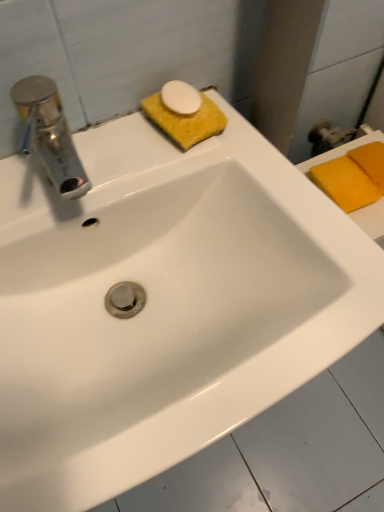
Question: From the image's perspective, is yellow sponge at upper center, the 3th soap viewed from the right, positioned above or below yellow sponge at right, acting as the first soap starting from the right?

Choices:
 (A) above
 (B) below

Answer: (A)

Question: In the image, is yellow sponge at upper center, which is the 3th soap in back-to-front order, positioned in front of or behind yellow sponge at right, acting as the first soap starting from the right?

Choices:
 (A) front
 (B) behind

Answer: (A)

Question: Which is nearer to the yellow sponge at upper center, positioned as the 1th soap in left-to-right order?

Choices:
 (A) orange sponge at upper right, the second soap positioned from the back
 (B) yellow sponge at right, acting as the first soap starting from the right

Answer: (A)

Question: Which is nearer to the yellow sponge at upper center, acting as the 1th soap starting from the front?

Choices:
 (A) orange sponge at upper right, acting as the second soap starting from the left
 (B) yellow sponge at right, the third soap from the front

Answer: (A)